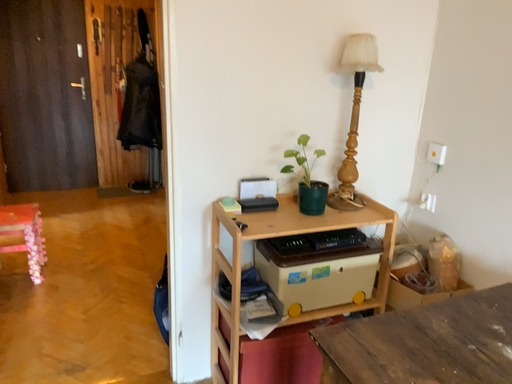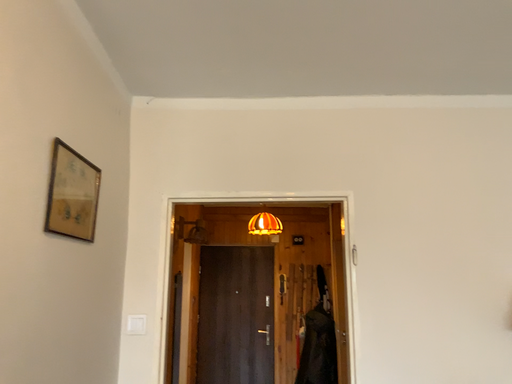
Question: How did the camera likely rotate when shooting the video?

Choices:
 (A) rotated left
 (B) rotated right

Answer: (A)